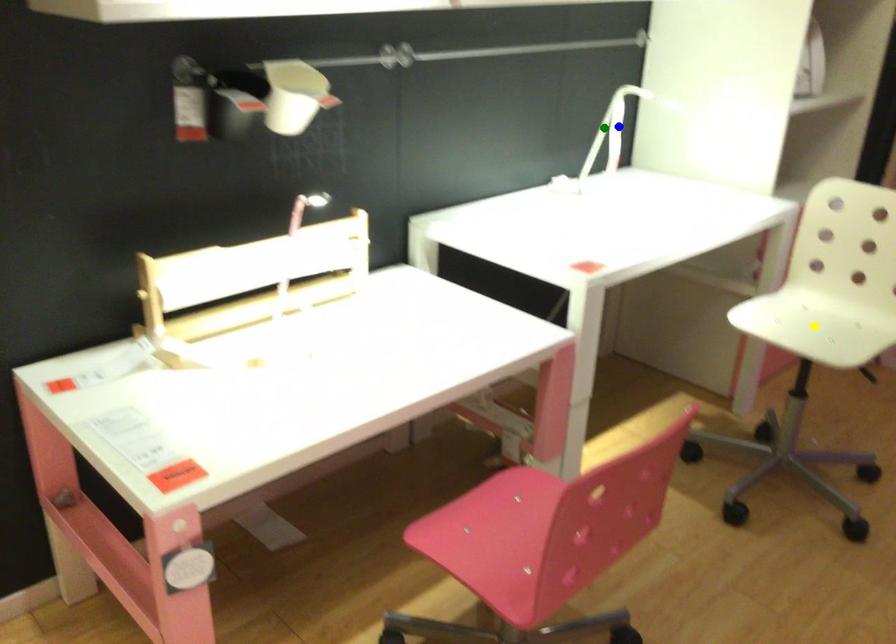
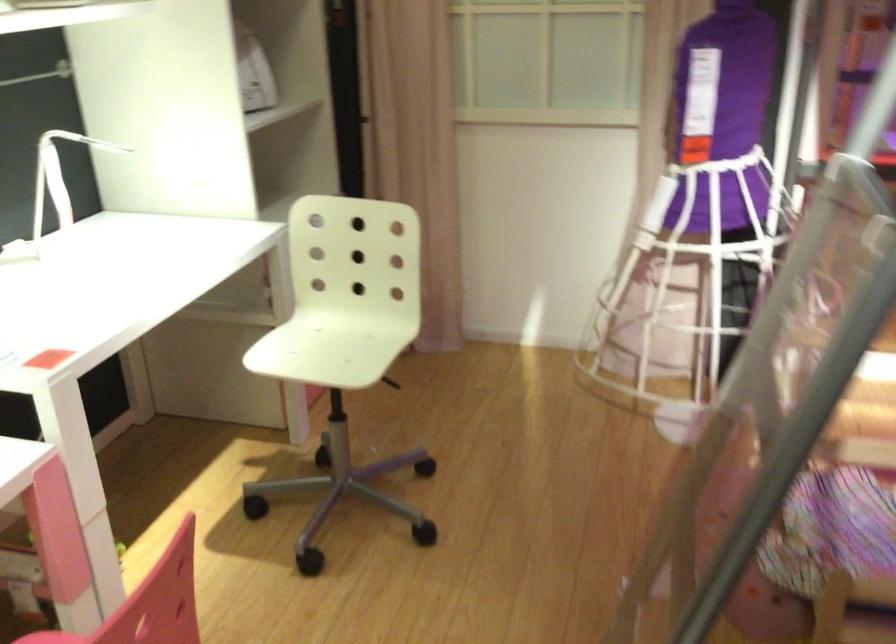
I am providing you with two images of the same scene from different viewpoints. Three points are marked in image1. Which point corresponds to a part or object that is occluded in image2?In image1, three points are marked. Which of them correspond to a part or object that is occluded in image2?Among the three points shown in image1, which one corresponds to a part or object that is no longer visible due to occlusion in image2?

blue point